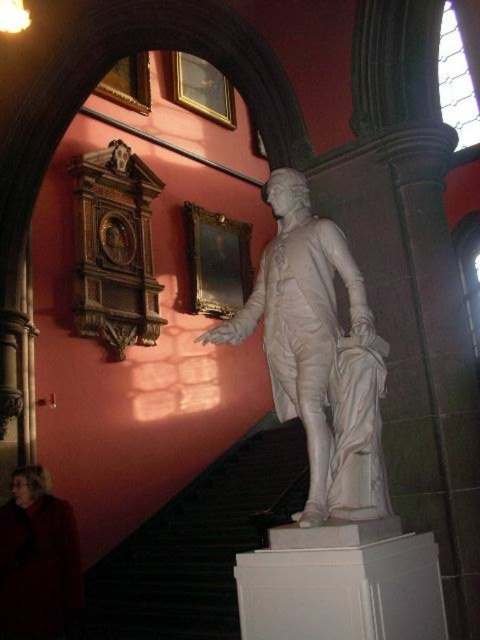
Question: Which object is closer to the camera taking this photo?

Choices:
 (A) black marble stairs at center
 (B) velvet red coat at lower left

Answer: (B)

Question: Can you confirm if black marble stairs at center is bigger than velvet red coat at lower left?

Choices:
 (A) no
 (B) yes

Answer: (B)

Question: Among these points, which one is farthest from the camera?

Choices:
 (A) (294, 502)
 (B) (29, 515)

Answer: (A)

Question: In this image, where is white marble statue at center located relative to velvet red coat at lower left?

Choices:
 (A) right
 (B) left

Answer: (A)

Question: Can you confirm if white marble statue at center is positioned above velvet red coat at lower left?

Choices:
 (A) yes
 (B) no

Answer: (A)

Question: Which object is the farthest from the white marble statue at center?

Choices:
 (A) black marble stairs at center
 (B) velvet red coat at lower left

Answer: (A)